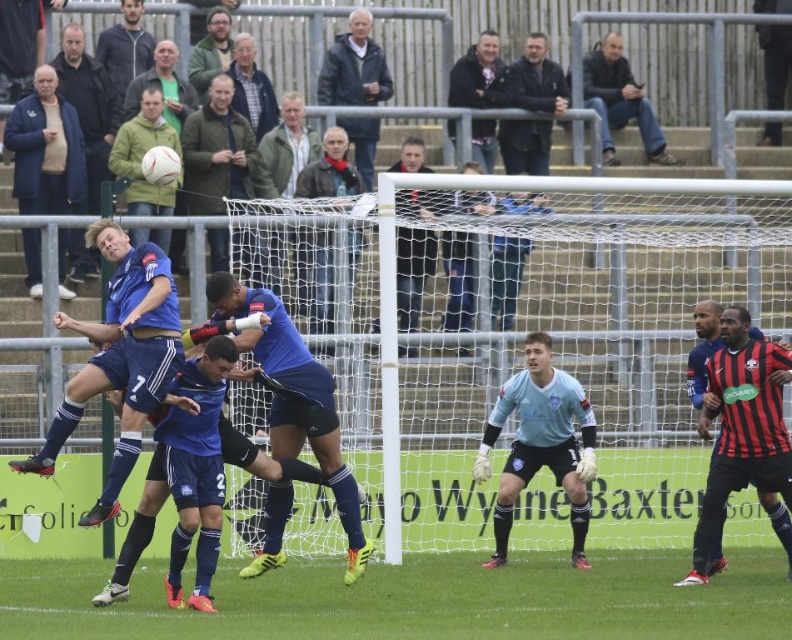
Does dark blue leather jacket at upper center appear on the right side of green textured jacket at upper center?

Correct, you'll find dark blue leather jacket at upper center to the right of green textured jacket at upper center.

Locate an element on the screen. dark blue leather jacket at upper center is located at coordinates (535, 80).

This screenshot has height=640, width=792. In order to click on dark blue leather jacket at upper center in this screenshot , I will do `click(535, 80)`.

Is point (495, 154) positioned in front of point (204, 61)?

No, (495, 154) is behind (204, 61).

The image size is (792, 640). In order to click on light brown leather jacket at upper center in this screenshot , I will do 478,76.

Locate an element on the screen. light brown leather jacket at upper center is located at coordinates (478, 76).

Does dark brown leather jacket at upper right appear under green textured jacket at upper center?

Indeed, dark brown leather jacket at upper right is positioned under green textured jacket at upper center.

Is point (631, 96) in front of point (191, 52)?

No, it is behind (191, 52).

Locate an element on the screen. The image size is (792, 640). dark brown leather jacket at upper right is located at coordinates (619, 100).